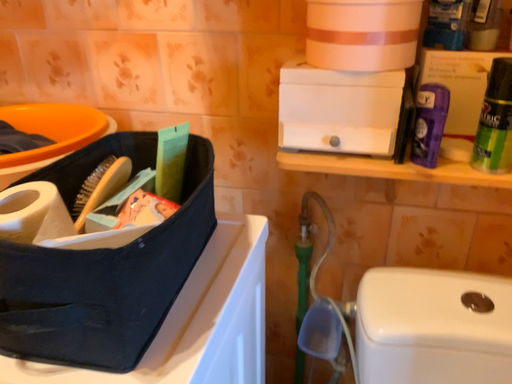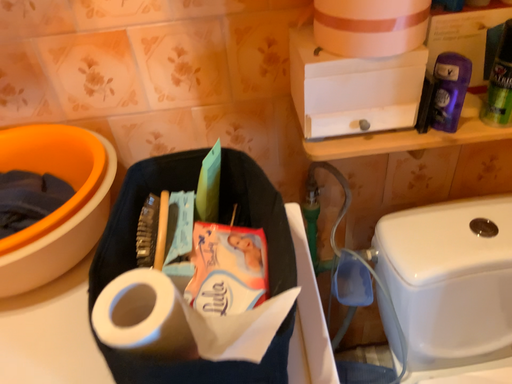
Question: How did the camera likely rotate when shooting the video?

Choices:
 (A) rotated left
 (B) rotated right

Answer: (B)